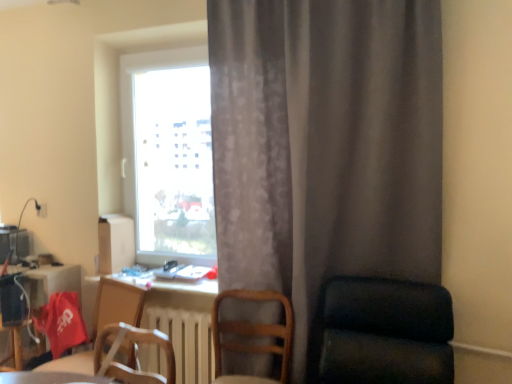
Question: Is transparent glass window at center closer to the viewer compared to white glossy table at lower left?

Choices:
 (A) yes
 (B) no

Answer: (B)

Question: Considering the relative positions of transparent glass window at center and white glossy table at lower left in the image provided, is transparent glass window at center behind white glossy table at lower left?

Choices:
 (A) yes
 (B) no

Answer: (A)

Question: Is transparent glass window at center directly adjacent to white glossy table at lower left?

Choices:
 (A) yes
 (B) no

Answer: (B)

Question: From a real-world perspective, is transparent glass window at center beneath white glossy table at lower left?

Choices:
 (A) yes
 (B) no

Answer: (B)

Question: From the image's perspective, is transparent glass window at center below white glossy table at lower left?

Choices:
 (A) no
 (B) yes

Answer: (A)

Question: From the image's perspective, is wooden chair at lower center, the second chair from the left, positioned above or below gray textured curtain at center?

Choices:
 (A) below
 (B) above

Answer: (A)

Question: Is wooden chair at lower center, the second chair from the left, in front of or behind gray textured curtain at center in the image?

Choices:
 (A) behind
 (B) front

Answer: (A)

Question: Is point (287, 334) positioned closer to the camera than point (310, 218)?

Choices:
 (A) closer
 (B) farther

Answer: (B)

Question: In terms of height, does wooden chair at lower center, the 2th chair viewed from the right, look taller or shorter compared to gray textured curtain at center?

Choices:
 (A) short
 (B) tall

Answer: (A)

Question: Considering the positions of dark green fabric chair at right, which appears as the first chair when viewed from the right, and transparent glass window at center in the image, is dark green fabric chair at right, which appears as the first chair when viewed from the right, bigger or smaller than transparent glass window at center?

Choices:
 (A) small
 (B) big

Answer: (B)

Question: From a real-world perspective, relative to transparent glass window at center, is dark green fabric chair at right, which appears as the first chair when viewed from the right, vertically above or below?

Choices:
 (A) above
 (B) below

Answer: (B)

Question: Considering the relative positions of dark green fabric chair at right, which is counted as the third chair, starting from the left, and transparent glass window at center in the image provided, is dark green fabric chair at right, which is counted as the third chair, starting from the left, to the left or to the right of transparent glass window at center?

Choices:
 (A) left
 (B) right

Answer: (B)

Question: Is dark green fabric chair at right, which appears as the first chair when viewed from the right, wider or thinner than transparent glass window at center?

Choices:
 (A) wide
 (B) thin

Answer: (A)

Question: Considering the positions of matte black computer desk at lower left and white glossy table at lower left in the image, is matte black computer desk at lower left taller or shorter than white glossy table at lower left?

Choices:
 (A) short
 (B) tall

Answer: (B)

Question: Is point (x=38, y=271) positioned closer to the camera than point (x=44, y=372)?

Choices:
 (A) closer
 (B) farther

Answer: (B)